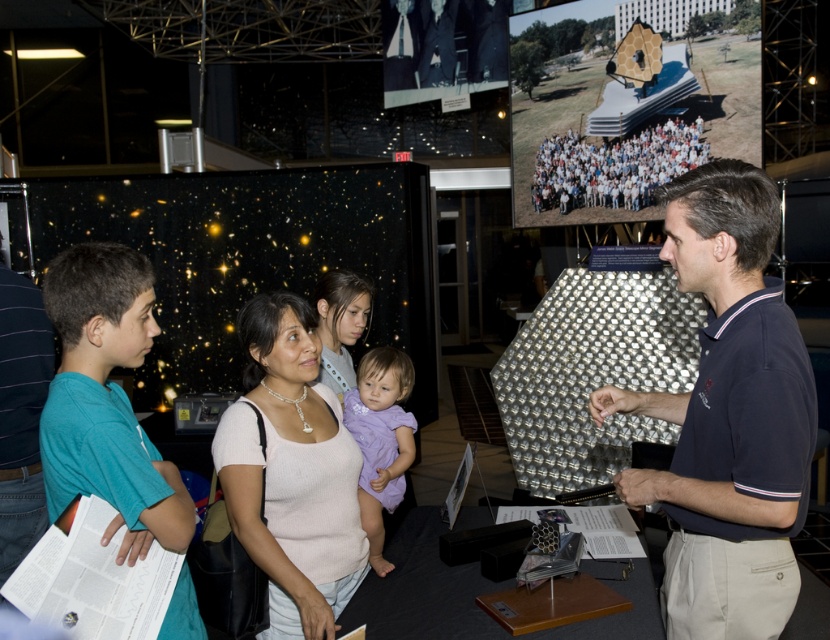
Question: Which point is farther to the camera?

Choices:
 (A) striped cotton shirt at left
 (B) matte white shirt at center
 (C) pink ribbed sweater at center
 (D) dark blue polo shirt at center

Answer: (B)

Question: Does purple fabric baby at center have a lesser width compared to matte white shirt at center?

Choices:
 (A) yes
 (B) no

Answer: (B)

Question: Among these points, which one is farthest from the camera?

Choices:
 (A) (0, 360)
 (B) (321, 321)

Answer: (B)

Question: Among these objects, which one is farthest from the camera?

Choices:
 (A) white clothed people at center
 (B) dark blue polo shirt at center
 (C) pink ribbed sweater at center
 (D) matte white shirt at center

Answer: (A)

Question: Can you confirm if striped cotton shirt at left is positioned below purple fabric baby at center?

Choices:
 (A) yes
 (B) no

Answer: (B)

Question: Can you confirm if white clothed people at center is positioned below matte white shirt at center?

Choices:
 (A) no
 (B) yes

Answer: (A)